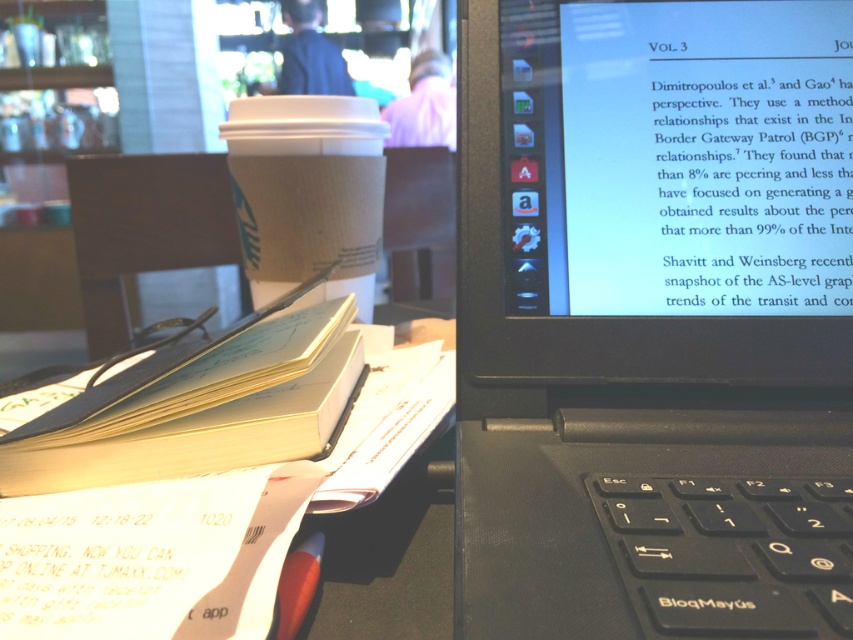
Question: Is black matte laptop at center further to camera compared to white cardboard cup at center?

Choices:
 (A) yes
 (B) no

Answer: (B)

Question: Where is matte black screen at upper right located in relation to white cardboard cup at center in the image?

Choices:
 (A) right
 (B) left

Answer: (A)

Question: Which is nearer to the black matte laptop at center?

Choices:
 (A) yellow paper notebook at center
 (B) white cardboard cup at center

Answer: (A)

Question: Is black matte laptop at center behind yellow paper notebook at center?

Choices:
 (A) yes
 (B) no

Answer: (B)

Question: Which point is farther from the camera taking this photo?

Choices:
 (A) (664, 128)
 (B) (726, 518)
 (C) (300, 428)
 (D) (292, 125)

Answer: (D)

Question: Which point is farther from the camera taking this photo?

Choices:
 (A) (170, 404)
 (B) (322, 116)
 (C) (814, 200)

Answer: (B)